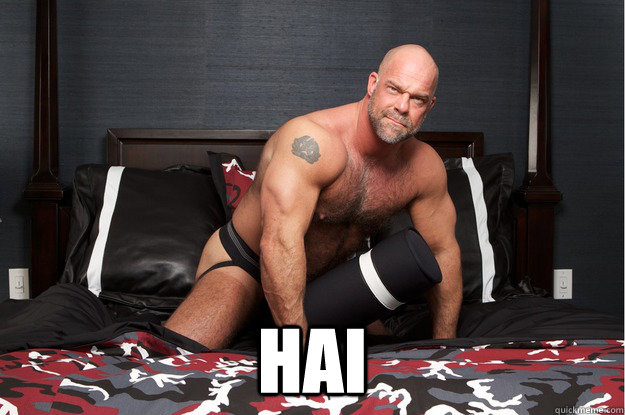
Image resolution: width=625 pixels, height=415 pixels. Identify the location of bed post. (537, 212), (42, 194).